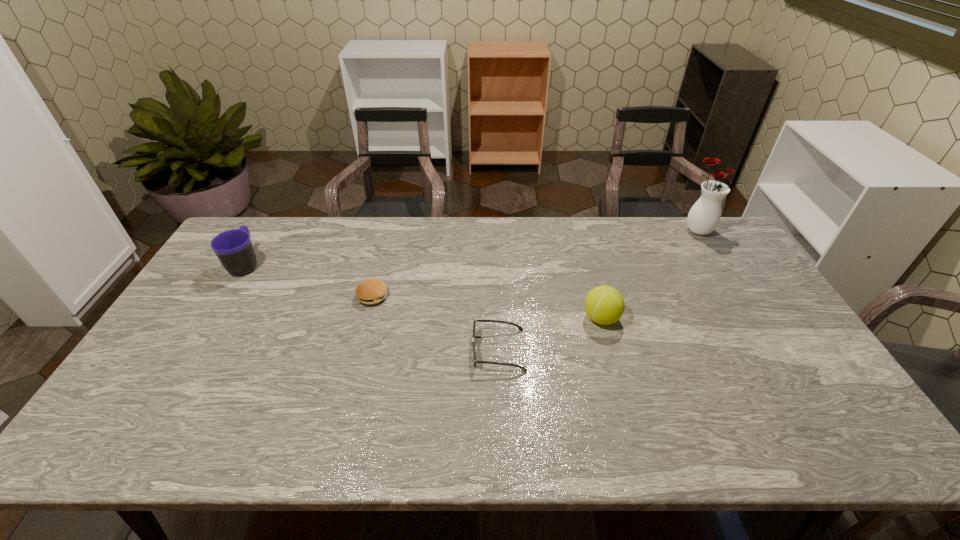
I want to click on free location that satisfies the following two spatial constraints: 1. on the back side of the patty; 2. on the right side of the vase, so click(390, 230).

Identify the location of free space that satisfies the following two spatial constraints: 1. on the back side of the second object from right to left; 2. on the left side of the vase. (577, 230).

Where is `free point that satisfies the following two spatial constraints: 1. on the back side of the fourth object from left to right; 2. on the left side of the rightmost object`? The width and height of the screenshot is (960, 540). free point that satisfies the following two spatial constraints: 1. on the back side of the fourth object from left to right; 2. on the left side of the rightmost object is located at coordinates (577, 230).